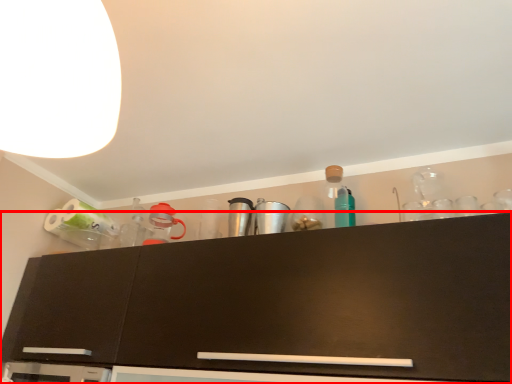
Question: From the image's perspective, where is cabinetry (annotated by the red box) located in relation to lamp in the image?

Choices:
 (A) below
 (B) above

Answer: (A)